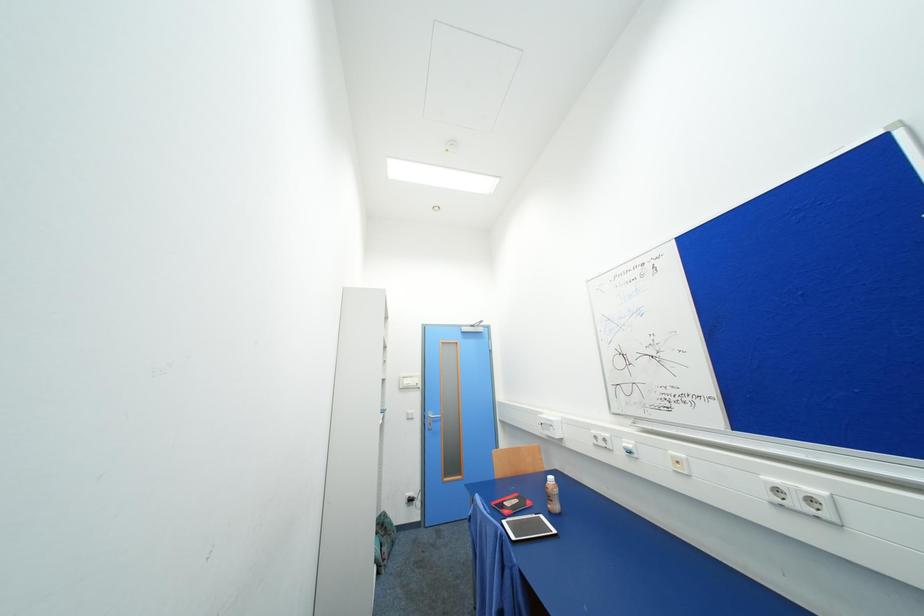
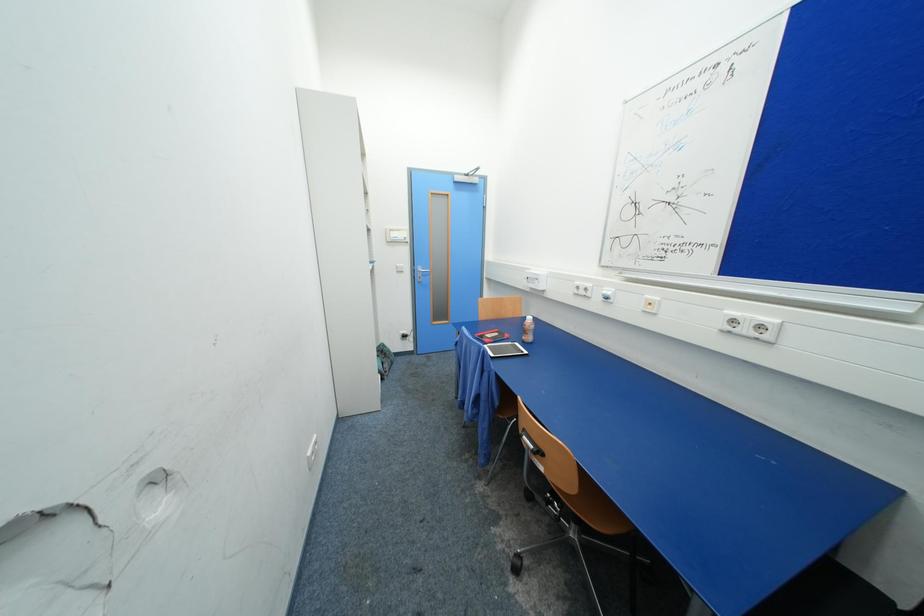
Question: The first image is from the beginning of the video and the second image is from the end. How did the camera likely rotate when shooting the video?

Choices:
 (A) Left
 (B) Right
 (C) Up
 (D) Down

Answer: (D)